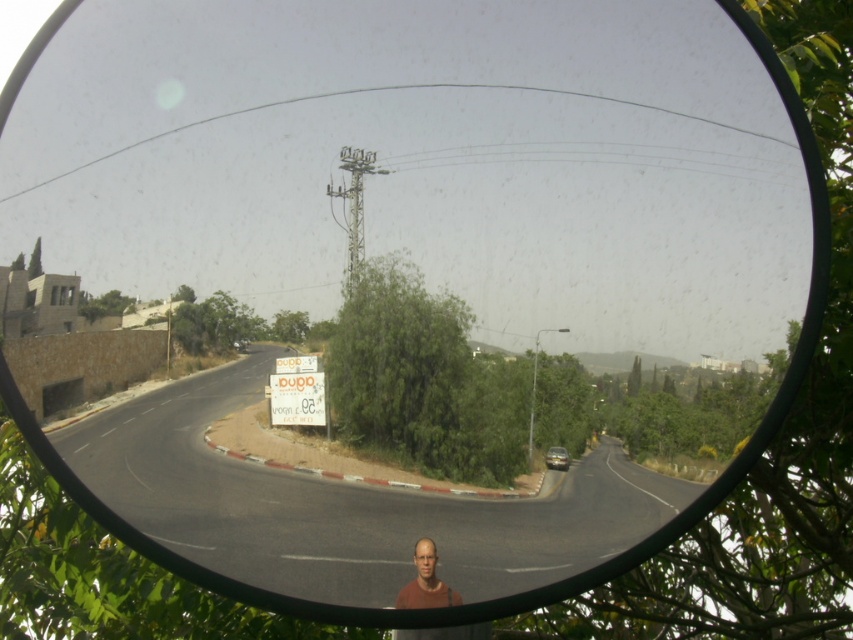
You are looking at the convex mirror reflection and see two points marked in the image. Based on their positions in the reflection, which point is closer to the camera, point at coordinates point (419, 576) or point (554, 445)?

Point (419, 576) is closer to the camera than point (554, 445).